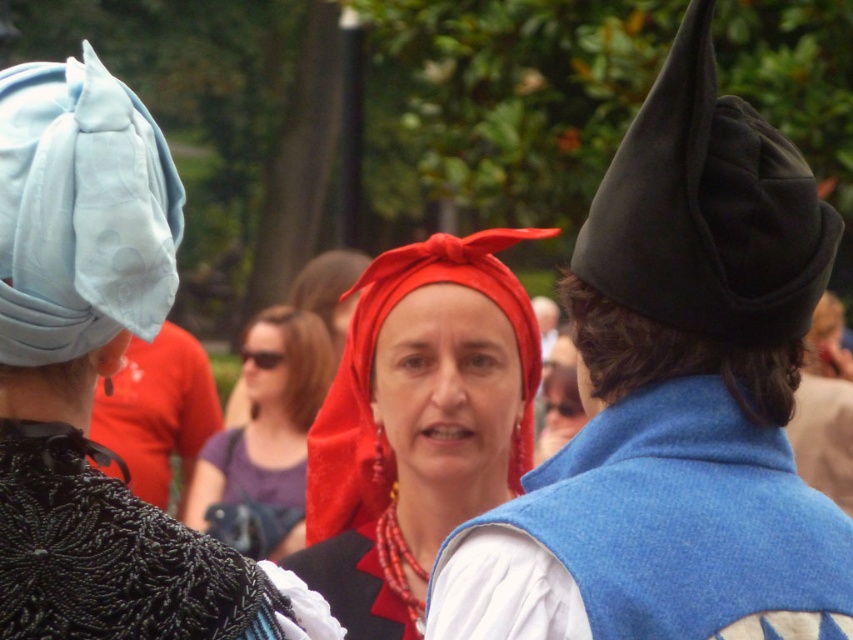
You are a costume designer observing this scene and need to adjust the placement of the black felt hat at upper right and the matte black hat at left for a better visual balance. Based on their current positions, which hat is located to the right of the other?

The black felt hat at upper right is positioned on the right side of matte black hat at left.

You are a photographer at the event and want to position a camera to capture both the matte red fabric headscarf at center and the matte black hat at left in the same frame. Which direction should you move the camera to ensure both are visible?

You should move the camera to the left to include both the matte red fabric headscarf at center and the matte black hat at left in the frame since the matte red fabric headscarf at center is to the right of the matte black hat at left.

You are a costume designer observing the historical reenactment. You need to determine which headscarf is higher in height between the matte red fabric headscarf at center and the light blue fabric headscarf at upper left. Based on the scene, which one is taller?

The matte red fabric headscarf at center is taller than the light blue fabric headscarf at upper left.